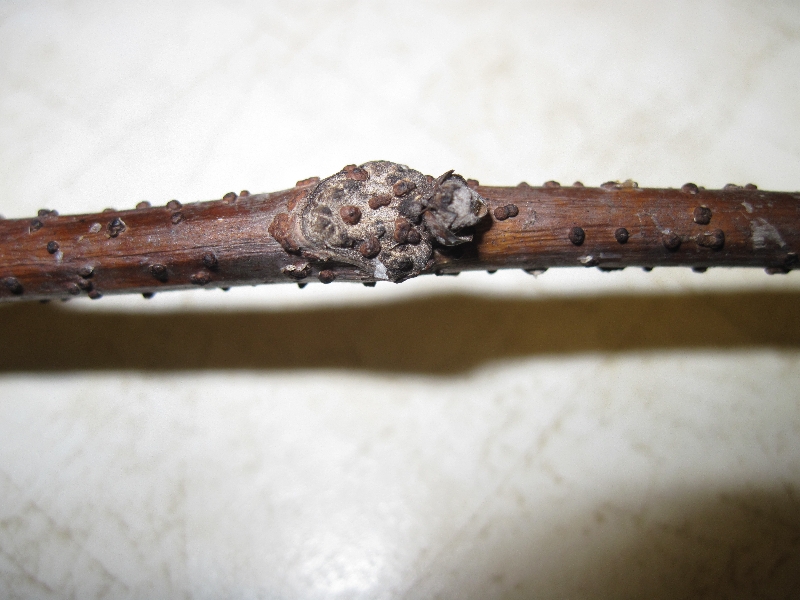
Locate an element on the screen. The image size is (800, 600). cream colored tile is located at coordinates (388, 531).